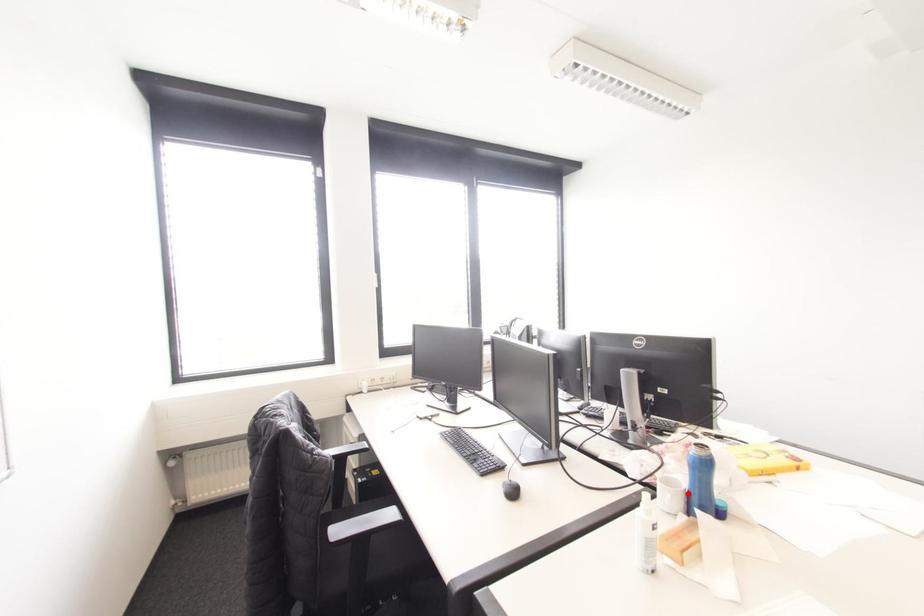
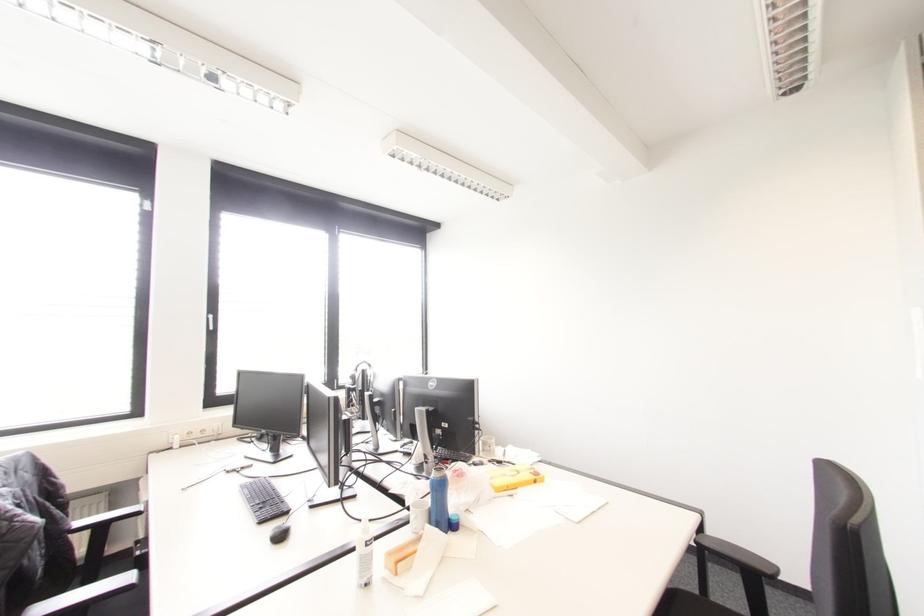
Find the pixel in the second image that matches the highlighted location in the first image.

(429, 512)